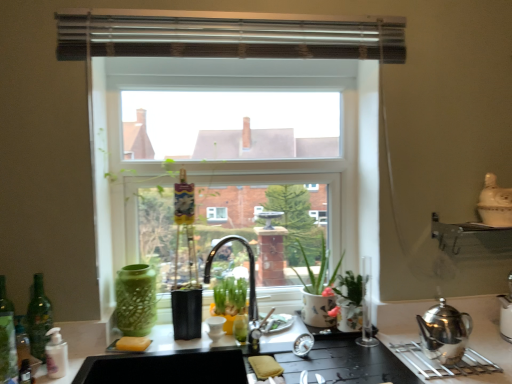
Question: Does point 6,375 appear closer or farther from the camera than point 135,350?

Choices:
 (A) farther
 (B) closer

Answer: (B)

Question: From the image's perspective, is green glass bottle at left, the 3th bottle positioned from the right, located above or below yellow matte sponge at lower center?

Choices:
 (A) above
 (B) below

Answer: (A)

Question: Which is farther from the green matte plant at center?

Choices:
 (A) green glass bottle at left, acting as the 2th bottle starting from the right
 (B) clear glass window at center
 (C) white matte bottle at lower left, the 3th bottle viewed from the left
 (D) metallic silver exhaust hood at upper center
 (E) silver metallic teapot at right

Answer: (D)

Question: Estimate the real-world distances between objects in this image. Which object is closer to the silver metallic teapot at right?

Choices:
 (A) green glass bottle at left, the 3th bottle positioned from the right
 (B) white ceramic pot at center
 (C) white ceramic vase at upper right
 (D) clear glass window at center
 (E) white matte bottle at lower left, the 3th bottle viewed from the left

Answer: (B)